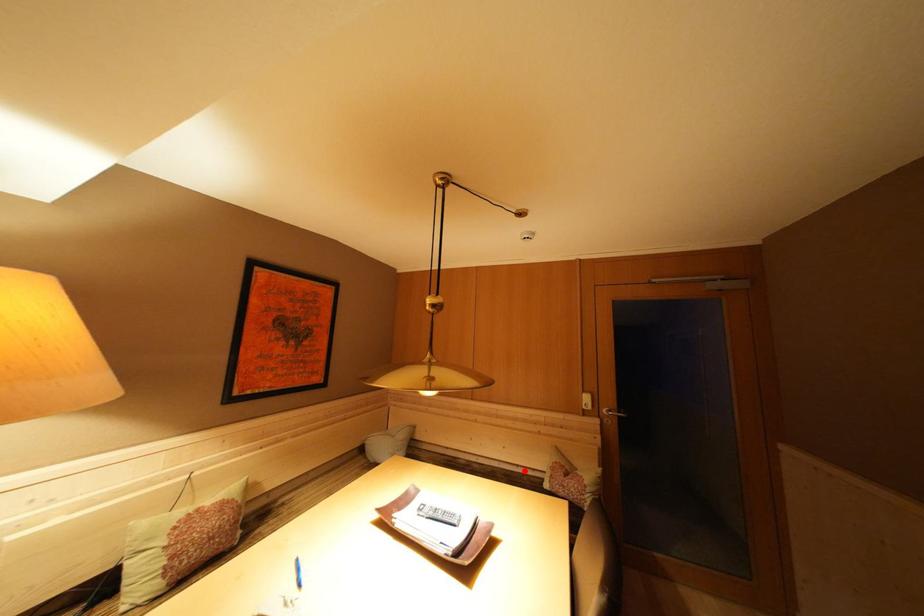
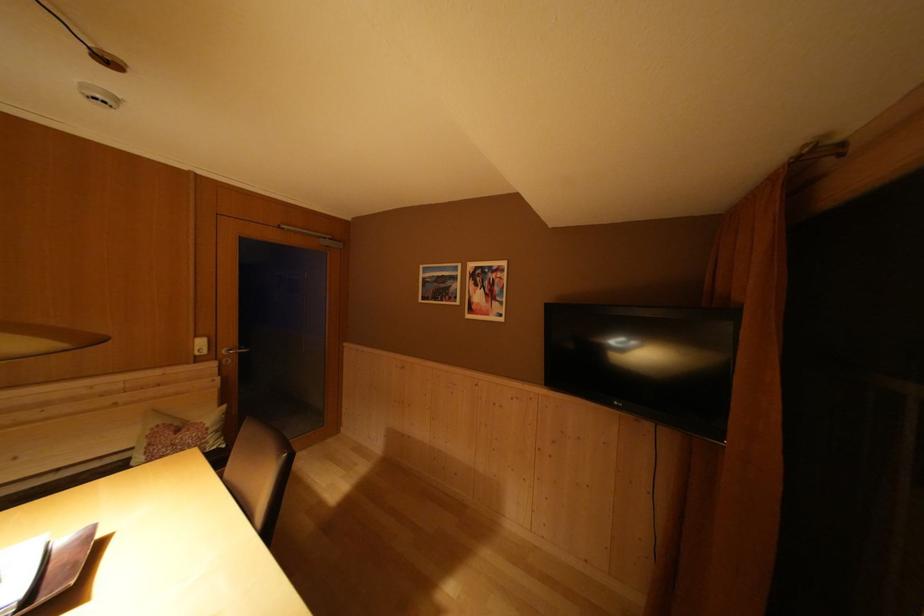
Question: I am providing you with two images of the same scene from different viewpoints. A red point is marked on the first image. Can you still see the location of the red point in image 2?

Choices:
 (A) Yes
 (B) No

Answer: (A)